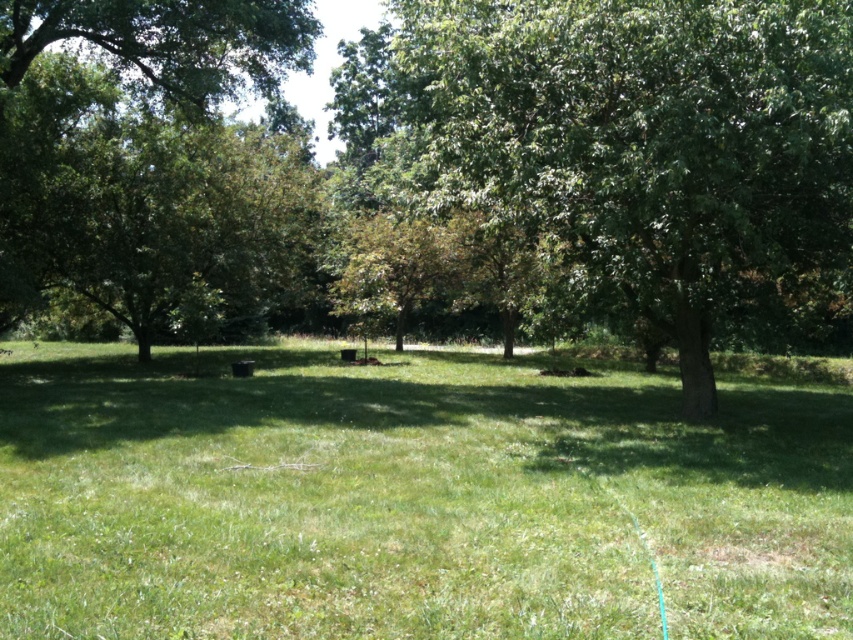
You are standing at the point with coordinates point (67, 26) and want to walk to the point with coordinates point (439, 86). Which direction should you move in to reach your destination?

You should move forward because point (439, 86) is in front of point (67, 26).

You are a gardener who needs to water the green leafy tree at center and the green grassy field at center. Your watering can has a range of 3 meters. Can you water both areas without moving the watering can?

The distance between the green grassy field at center and the green leafy tree at center is 4.04 meters. Since the watering can only reaches 3 meters, you cannot water both areas without moving the watering can.

You are a gardener who needs to water the green grassy field at center and the green leafy tree at left. Which one should you water first if you want to start from the highest point in the scene?

The green leafy tree at left should be watered first because it is located above the green grassy field at center.